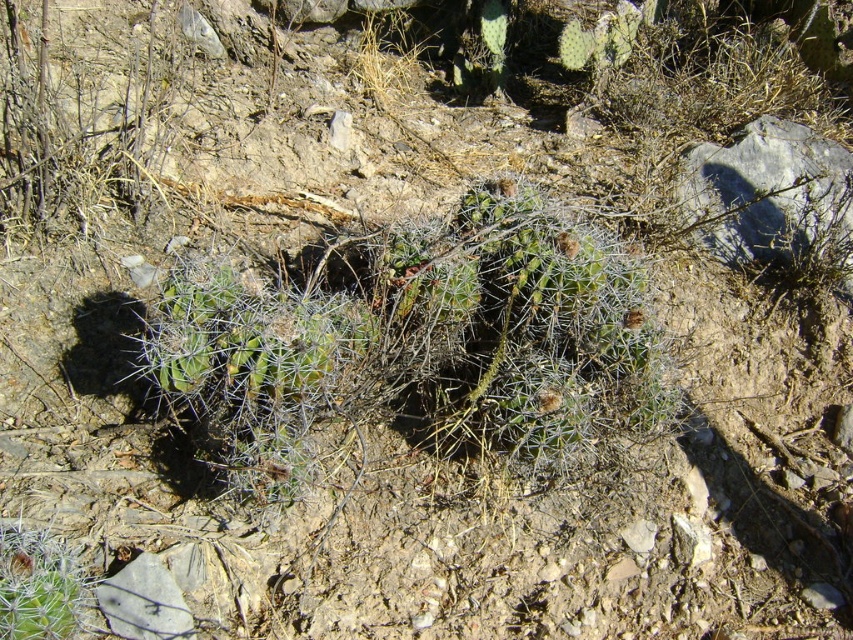
Question: Is spiky green cactus at center below green spiny cactus at center?

Choices:
 (A) no
 (B) yes

Answer: (A)

Question: In this image, where is spiky green cactus at center located relative to green spiny cactus at center?

Choices:
 (A) above
 (B) below

Answer: (A)

Question: Which object appears closest to the camera in this image?

Choices:
 (A) green spiny cactus at center
 (B) spiky green cactus at center

Answer: (A)

Question: Can you confirm if spiky green cactus at center is positioned above green spiny cactus at center?

Choices:
 (A) no
 (B) yes

Answer: (B)

Question: Which of the following is the closest to the observer?

Choices:
 (A) coord(257,365)
 (B) coord(10,541)

Answer: (B)